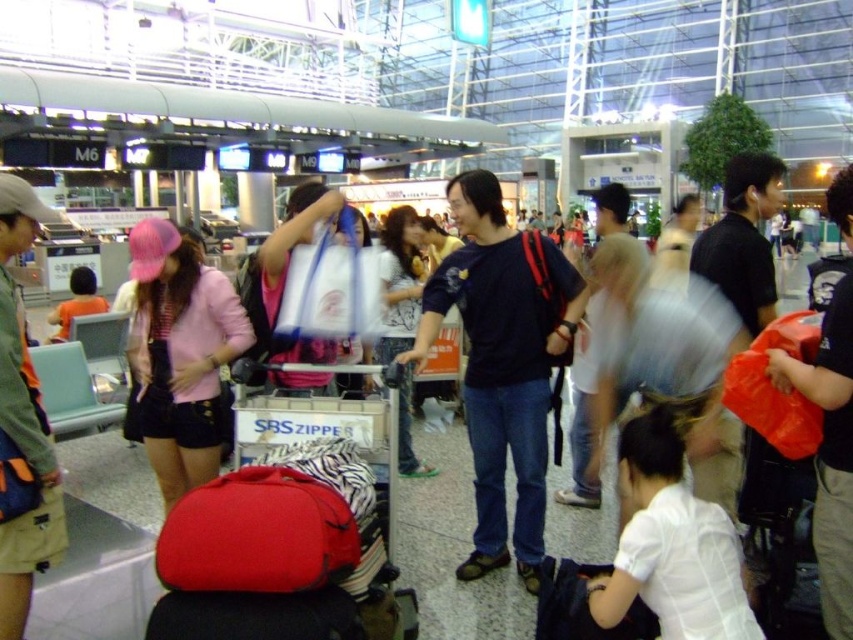
You are standing at the point labeled as point (628, 602) in the airport terminal. You want to reach the nearest exit, which is located 3 meters away from your current position. Can you safely walk to the exit without needing to move any obstacles?

The distance between point (628, 602) and the viewer is 2.60 meters. Since the exit is 3 meters away, you are still 0.4 meters away from the exit and can safely walk there without needing to move any obstacles.

What is located at the coordinates point (181, 355)?

The point (181, 355) is on the pink knitted hat at left.

You are an airport staff member who needs to place a new luggage cart in the terminal. The cart must be positioned in a spot where it won not block the pink knitted hat at left and the denim jeans at center. Based on their sizes, which object requires more space to accommodate?

The denim jeans at center requires more space to accommodate because the pink knitted hat at left occupies less space than denim jeans at center.